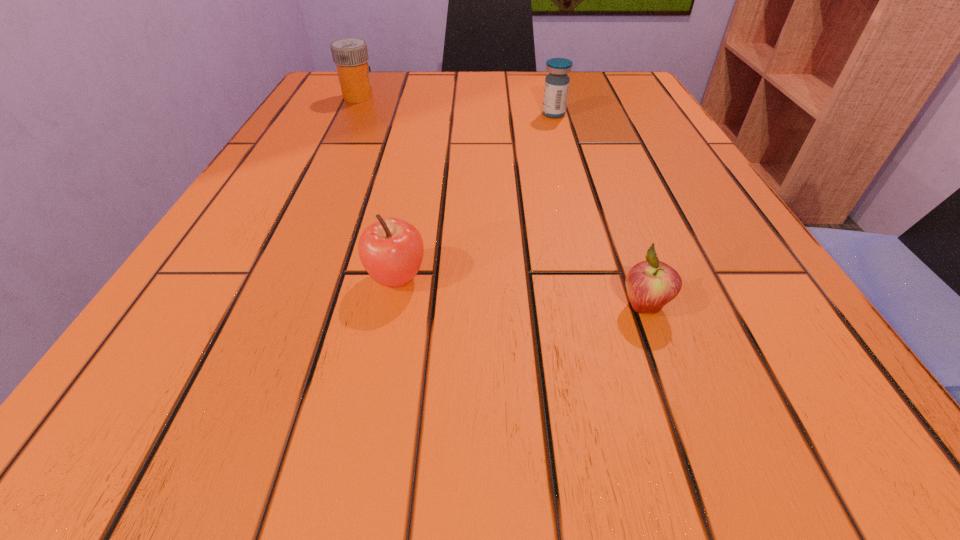
Locate an element on the screen. vacant region that satisfies the following two spatial constraints: 1. on the label side of the farthest object; 2. on the back side of the left apple is located at coordinates (269, 278).

The height and width of the screenshot is (540, 960). In order to click on blank space that satisfies the following two spatial constraints: 1. on the label side of the second farthest object; 2. on the right side of the left medicine in this screenshot , I will do `click(349, 114)`.

Find the location of `free space in the image that satisfies the following two spatial constraints: 1. on the label side of the right apple; 2. on the left side of the farther medicine`. free space in the image that satisfies the following two spatial constraints: 1. on the label side of the right apple; 2. on the left side of the farther medicine is located at coordinates (254, 306).

This screenshot has width=960, height=540. What are the coordinates of `free space that satisfies the following two spatial constraints: 1. on the label side of the second farthest object; 2. on the right side of the farthest object` in the screenshot? It's located at (x=349, y=114).